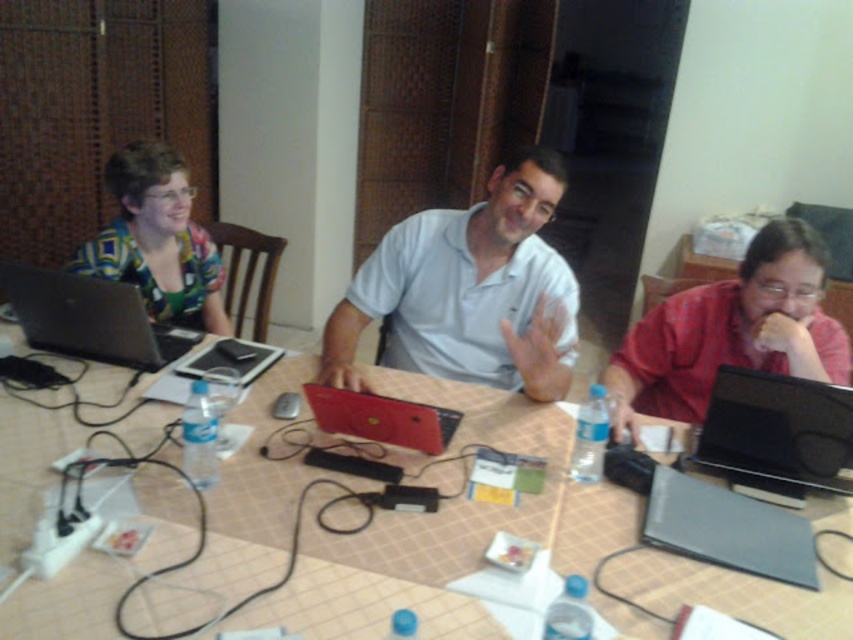
Does red matte shirt at right have a lesser width compared to matte multicolored shirt at upper left?

No, red matte shirt at right is not thinner than matte multicolored shirt at upper left.

Can you confirm if red matte shirt at right is positioned above matte multicolored shirt at upper left?

Actually, red matte shirt at right is below matte multicolored shirt at upper left.

Which is behind, point (819, 276) or point (193, 252)?

Positioned behind is point (193, 252).

Locate an element on the screen. The height and width of the screenshot is (640, 853). red matte shirt at right is located at coordinates (730, 332).

Does light blue cotton shirt at center appear on the right side of matte black laptop at left?

Indeed, light blue cotton shirt at center is positioned on the right side of matte black laptop at left.

Does light blue cotton shirt at center have a smaller size compared to matte black laptop at left?

Actually, light blue cotton shirt at center might be larger than matte black laptop at left.

Measure the distance between light blue cotton shirt at center and camera.

A distance of 1.72 meters exists between light blue cotton shirt at center and camera.

The height and width of the screenshot is (640, 853). Find the location of `light blue cotton shirt at center`. light blue cotton shirt at center is located at coordinates (468, 291).

Does light blue cotton shirt at center appear over red matte shirt at right?

Correct, light blue cotton shirt at center is located above red matte shirt at right.

Which is more to the left, light blue cotton shirt at center or red matte shirt at right?

From the viewer's perspective, light blue cotton shirt at center appears more on the left side.

Is point (421, 237) positioned after point (778, 257)?

Yes, it is behind point (778, 257).

At what (x,y) coordinates should I click in order to perform the action: click on light blue cotton shirt at center. Please return your answer as a coordinate pair (x, y). Looking at the image, I should click on (468, 291).